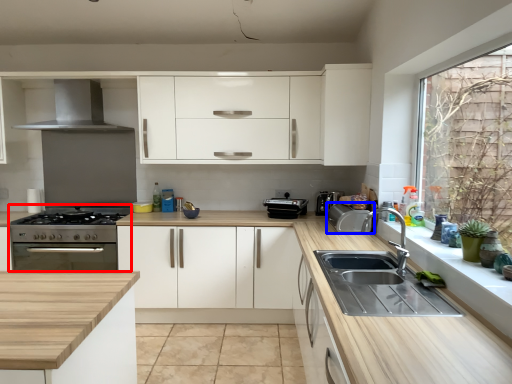
Question: Which point is further to the camera, appliance (highlighted by a red box) or appliance (highlighted by a blue box)?

Choices:
 (A) appliance
 (B) appliance

Answer: (A)